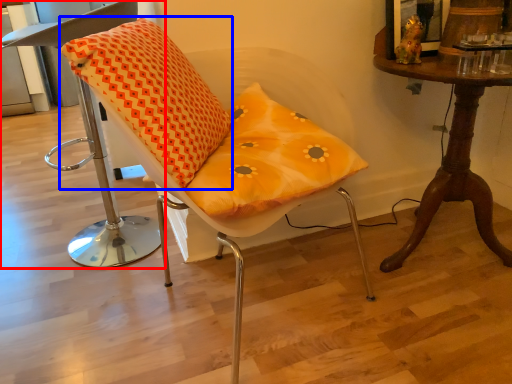
Question: Which point is closer to the camera, chair (highlighted by a red box) or throw pillow (highlighted by a blue box)?

Choices:
 (A) chair
 (B) throw pillow

Answer: (B)